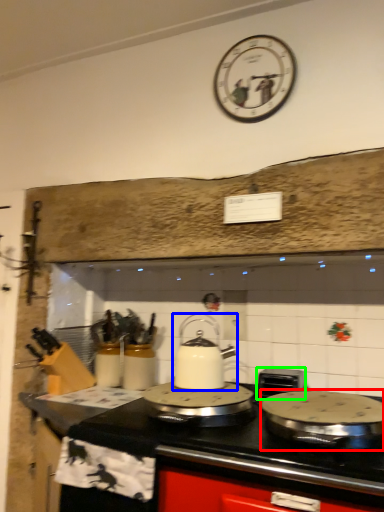
Question: Based on their relative distances, which object is nearer to kitchen appliance (highlighted by a red box)? Choose from kitchen appliance (highlighted by a blue box) and appliance (highlighted by a green box).

Choices:
 (A) kitchen appliance
 (B) appliance

Answer: (B)